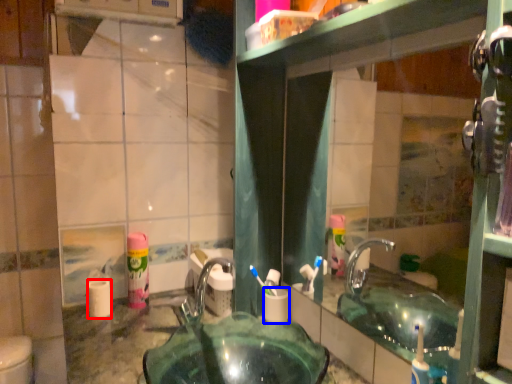
Question: Among these objects, which one is farthest to the camera, toilet paper (highlighted by a red box) or toilet paper (highlighted by a blue box)?

Choices:
 (A) toilet paper
 (B) toilet paper

Answer: (A)